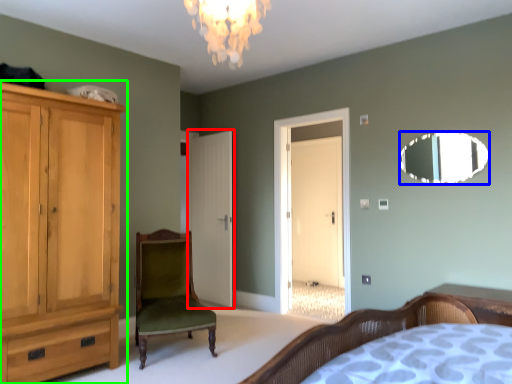
Question: Which is nearer to the door (highlighted by a red box)? mirror (highlighted by a blue box) or cabinetry (highlighted by a green box).

Choices:
 (A) mirror
 (B) cabinetry

Answer: (B)